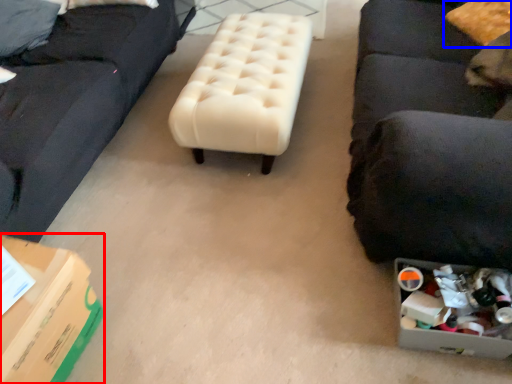
Question: Which object appears farthest to the camera in this image, cardboard box (highlighted by a red box) or pillow (highlighted by a blue box)?

Choices:
 (A) cardboard box
 (B) pillow

Answer: (B)